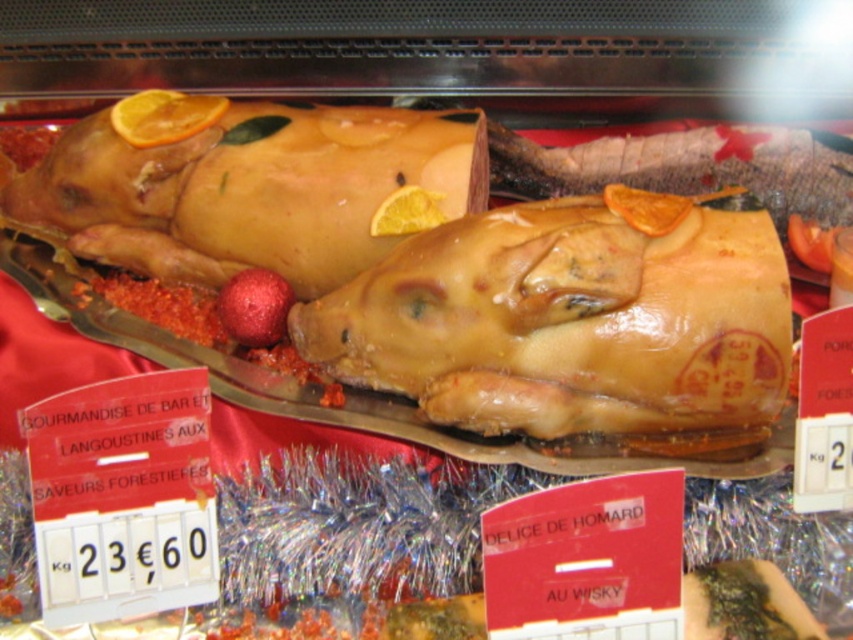
Is shiny golden pig at center bigger than golden-brown roasted pig at center?

No.

Can you confirm if shiny golden pig at center is positioned below golden-brown roasted pig at center?

Correct, shiny golden pig at center is located below golden-brown roasted pig at center.

Is point (503, 358) less distant than point (18, 214)?

Yes, point (503, 358) is closer to viewer.

The width and height of the screenshot is (853, 640). Find the location of `shiny golden pig at center`. shiny golden pig at center is located at coordinates (573, 324).